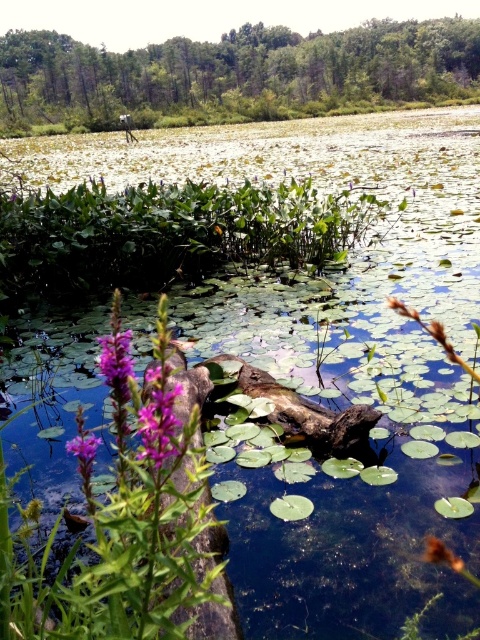
Is point (359, 28) behind point (117, 358)?

Yes, it is.

Does point (396, 20) come closer to viewer compared to point (129, 362)?

No, (396, 20) is further to viewer.

The image size is (480, 640). I want to click on green leafy tree at upper center, so click(x=235, y=76).

Describe the element at coordinates (235, 76) in the screenshot. I see `green leafy tree at upper center` at that location.

Does green leafy tree at upper center lie behind purple matte flower at center-left?

Yes.

Who is more distant from viewer, [158,80] or [164,394]?

Positioned behind is point [158,80].

What are the coordinates of `green leafy tree at upper center` in the screenshot? It's located at (235, 76).

Does purple matte flower at center-left lie in front of purple matte flower at lower left?

Yes, it is.

Who is more forward, (147, 376) or (120, 378)?

Point (120, 378)

Does point (154, 392) come behind point (132, 365)?

That is False.

Where is `purple matte flower at center-left`? purple matte flower at center-left is located at coordinates (157, 416).